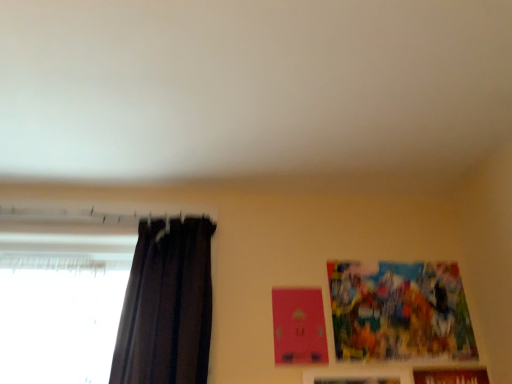
Question: Can you confirm if dark matte curtain at left is wider than brown wooden picture frame at lower right, the 1th picture frame ordered from the bottom?

Choices:
 (A) no
 (B) yes

Answer: (B)

Question: Is dark matte curtain at left turned away from brown wooden picture frame at lower right, which is the third picture frame in top-to-bottom order?

Choices:
 (A) yes
 (B) no

Answer: (B)

Question: Is dark matte curtain at left not inside brown wooden picture frame at lower right, which is the third picture frame in top-to-bottom order?

Choices:
 (A) yes
 (B) no

Answer: (A)

Question: From a real-world perspective, is dark matte curtain at left on top of brown wooden picture frame at lower right, which is the third picture frame in top-to-bottom order?

Choices:
 (A) no
 (B) yes

Answer: (B)

Question: Does dark matte curtain at left lie in front of brown wooden picture frame at lower right, the 1th picture frame ordered from the bottom?

Choices:
 (A) yes
 (B) no

Answer: (A)

Question: Is dark matte curtain at left in front of or behind brown wooden picture frame at lower right, the 1th picture frame ordered from the bottom, in the image?

Choices:
 (A) behind
 (B) front

Answer: (B)

Question: Considering the positions of point (192, 352) and point (461, 367), is point (192, 352) closer or farther from the camera than point (461, 367)?

Choices:
 (A) farther
 (B) closer

Answer: (B)

Question: Visually, is dark matte curtain at left positioned to the left or to the right of brown wooden picture frame at lower right, the 1th picture frame ordered from the bottom?

Choices:
 (A) left
 (B) right

Answer: (A)

Question: From a real-world perspective, relative to brown wooden picture frame at lower right, the 1th picture frame ordered from the bottom, is dark matte curtain at left vertically above or below?

Choices:
 (A) above
 (B) below

Answer: (A)

Question: Choose the correct answer: Is wooden picture frame at lower right, which ranks as the 2th picture frame in bottom-to-top order, inside dark matte curtain at left or outside it?

Choices:
 (A) inside
 (B) outside

Answer: (B)

Question: In terms of size, does wooden picture frame at lower right, which ranks as the 2th picture frame in bottom-to-top order, appear bigger or smaller than dark matte curtain at left?

Choices:
 (A) big
 (B) small

Answer: (B)

Question: Looking at their shapes, would you say wooden picture frame at lower right, which ranks as the 2th picture frame in bottom-to-top order, is wider or thinner than dark matte curtain at left?

Choices:
 (A) thin
 (B) wide

Answer: (A)

Question: From their relative heights in the image, would you say wooden picture frame at lower right, which is the 2th picture frame in top-to-bottom order, is taller or shorter than dark matte curtain at left?

Choices:
 (A) tall
 (B) short

Answer: (B)

Question: In terms of size, does colorful paper picture frame at upper right, which is the 1th picture frame from top to bottom, appear bigger or smaller than brown wooden picture frame at lower right, which is the third picture frame in top-to-bottom order?

Choices:
 (A) small
 (B) big

Answer: (B)

Question: Is colorful paper picture frame at upper right, which is the 1th picture frame from top to bottom, inside the boundaries of brown wooden picture frame at lower right, which is the third picture frame in top-to-bottom order, or outside?

Choices:
 (A) inside
 (B) outside

Answer: (B)